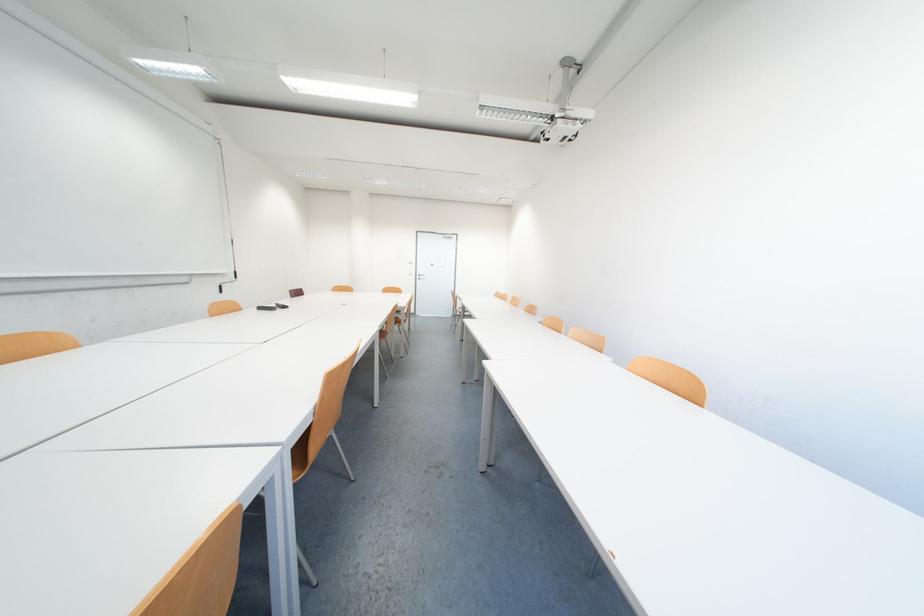
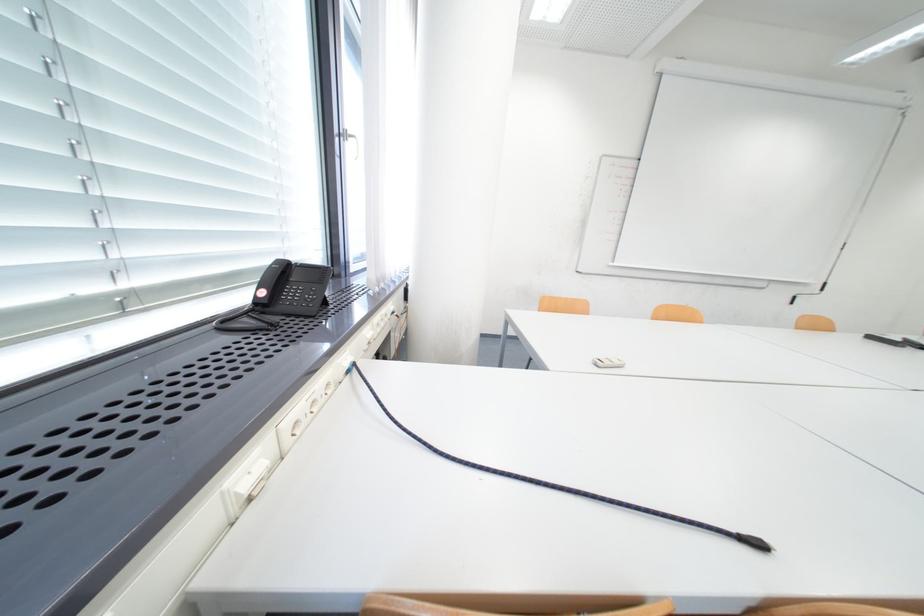
Question: Based on the continuous images, in which direction is the camera rotating? Reply with the corresponding letter.

Choices:
 (A) Left
 (B) Right
 (C) Up
 (D) Down

Answer: (A)